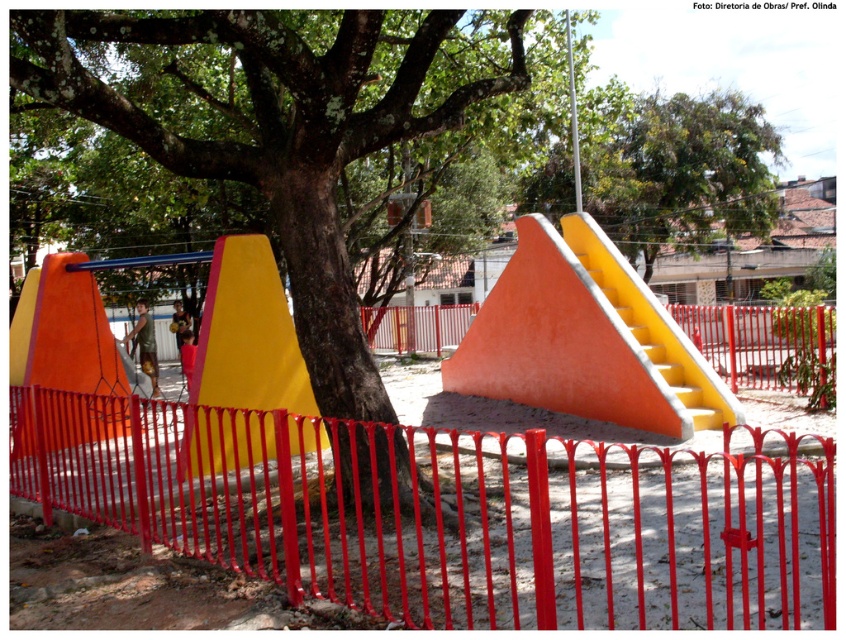
You are standing at the playground and want to place a new bench between the two points labeled point (724,486) and point (369,396). Since you want the bench to be closer to the tree, which point should you position it near?

To place the bench closer to the tree, position it near point (369,396) because it is farther from the viewer compared to point (724,486), implying it is located deeper into the playground where the tree is casting shadows.

In the scene shown: You are a parent trying to decide which play structure to let your child climb first. The orange matte slide at center and the metallic pole at upper center are both options. Which structure is smaller in size?

The orange matte slide at center has a smaller size compared to the metallic pole at upper center, so the orange matte slide at center is the smaller one.